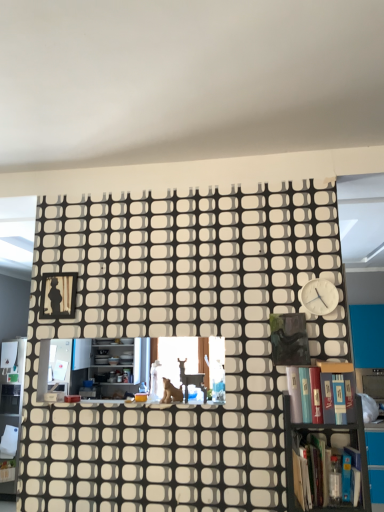
Question: From the image's perspective, would you say hardcover book at lower right, which appears as the second book when viewed from the top, is positioned over hardcover book at right, which is counted as the 2th book, starting from the bottom?

Choices:
 (A) yes
 (B) no

Answer: (B)

Question: Is hardcover book at lower right, which appears as the second book when viewed from the top, further to camera compared to hardcover book at right, which is counted as the 2th book, starting from the bottom?

Choices:
 (A) no
 (B) yes

Answer: (A)

Question: Does hardcover book at lower right, which appears as the second book when viewed from the top, have a lesser width compared to hardcover book at right, marked as the first book in a top-to-bottom arrangement?

Choices:
 (A) no
 (B) yes

Answer: (A)

Question: Is hardcover book at lower right, which appears as the second book when viewed from the top, not inside hardcover book at right, marked as the first book in a top-to-bottom arrangement?

Choices:
 (A) yes
 (B) no

Answer: (A)

Question: Does hardcover book at lower right, which is the 1th book from bottom to top, have a smaller size compared to hardcover book at right, which is counted as the 2th book, starting from the bottom?

Choices:
 (A) no
 (B) yes

Answer: (A)

Question: From their relative heights in the image, would you say metallic gray bookcase at lower right, arranged as the 2th bookcase when viewed from the back, is taller or shorter than hardcover book at lower right, which is the 1th book from bottom to top?

Choices:
 (A) tall
 (B) short

Answer: (A)

Question: Is metallic gray bookcase at lower right, arranged as the 2th bookcase when viewed from the back, bigger or smaller than hardcover book at lower right, which appears as the second book when viewed from the top?

Choices:
 (A) big
 (B) small

Answer: (A)

Question: Does point (x=294, y=475) appear closer or farther from the camera than point (x=289, y=437)?

Choices:
 (A) closer
 (B) farther

Answer: (A)

Question: Would you say metallic gray bookcase at lower right, arranged as the 2th bookcase when viewed from the back, is to the left or to the right of hardcover book at lower right, which is the 1th book from bottom to top, in the picture?

Choices:
 (A) left
 (B) right

Answer: (A)

Question: From the image's perspective, is wooden bookcase at center, which ranks as the first bookcase in back-to-front order, located above or below metallic gray bookcase at lower right, marked as the first bookcase in a front-to-back arrangement?

Choices:
 (A) above
 (B) below

Answer: (A)

Question: Considering the relative positions of wooden bookcase at center, which is counted as the 2th bookcase, starting from the front, and metallic gray bookcase at lower right, arranged as the 2th bookcase when viewed from the back, in the image provided, is wooden bookcase at center, which is counted as the 2th bookcase, starting from the front, to the left or to the right of metallic gray bookcase at lower right, arranged as the 2th bookcase when viewed from the back,?

Choices:
 (A) left
 (B) right

Answer: (A)

Question: Is wooden bookcase at center, which is counted as the 2th bookcase, starting from the front, wider or thinner than metallic gray bookcase at lower right, arranged as the 2th bookcase when viewed from the back?

Choices:
 (A) thin
 (B) wide

Answer: (A)

Question: Is wooden bookcase at center, which ranks as the first bookcase in back-to-front order, in front of or behind metallic gray bookcase at lower right, arranged as the 2th bookcase when viewed from the back, in the image?

Choices:
 (A) behind
 (B) front

Answer: (A)

Question: From a real-world perspective, is black matte picture frame at upper left positioned above or below metallic gray bookcase at lower right, marked as the first bookcase in a front-to-back arrangement?

Choices:
 (A) above
 (B) below

Answer: (A)

Question: Is black matte picture frame at upper left wider or thinner than metallic gray bookcase at lower right, arranged as the 2th bookcase when viewed from the back?

Choices:
 (A) thin
 (B) wide

Answer: (A)